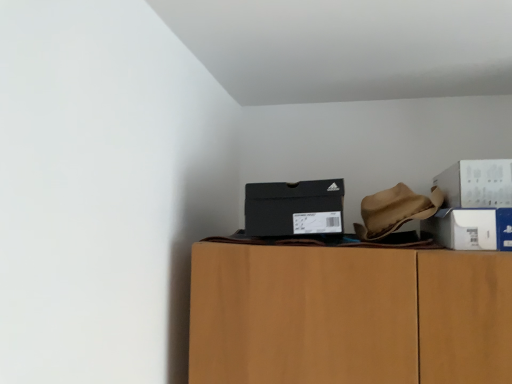
Question: Would you say white cardboard box at right, which ranks as the 2th box in right-to-left order, is outside black matte shoebox at upper center, which is counted as the 1th box, starting from the left?

Choices:
 (A) yes
 (B) no

Answer: (A)

Question: From a real-world perspective, is white cardboard box at right, which ranks as the 2th box in right-to-left order, on top of black matte shoebox at upper center, the 3th box from the right?

Choices:
 (A) yes
 (B) no

Answer: (B)

Question: Does white cardboard box at right, which is the second box from left to right, have a smaller size compared to black matte shoebox at upper center, which is counted as the 1th box, starting from the left?

Choices:
 (A) yes
 (B) no

Answer: (A)

Question: Is white cardboard box at right, which is the second box from left to right, positioned in front of black matte shoebox at upper center, which is counted as the 1th box, starting from the left?

Choices:
 (A) yes
 (B) no

Answer: (A)

Question: Is white cardboard box at right, which is the second box from left to right, aimed at black matte shoebox at upper center, which is counted as the 1th box, starting from the left?

Choices:
 (A) no
 (B) yes

Answer: (A)

Question: Which is correct: white cardboard box at right, which ranks as the 2th box in right-to-left order, is inside black matte shoebox at upper center, the 3th box from the right, or outside of it?

Choices:
 (A) outside
 (B) inside

Answer: (A)

Question: From a real-world perspective, is white cardboard box at right, which ranks as the 2th box in right-to-left order, above or below black matte shoebox at upper center, the 3th box from the right?

Choices:
 (A) below
 (B) above

Answer: (A)

Question: Is point (457, 226) closer or farther from the camera than point (258, 215)?

Choices:
 (A) farther
 (B) closer

Answer: (B)

Question: Is white cardboard box at right, which ranks as the 2th box in right-to-left order, bigger or smaller than black matte shoebox at upper center, the 3th box from the right?

Choices:
 (A) big
 (B) small

Answer: (B)

Question: Considering the positions of white cardboard box at upper right, the third box in the left-to-right sequence, and black matte shoebox at upper center, which is counted as the 1th box, starting from the left, in the image, is white cardboard box at upper right, the third box in the left-to-right sequence, wider or thinner than black matte shoebox at upper center, which is counted as the 1th box, starting from the left,?

Choices:
 (A) thin
 (B) wide

Answer: (B)

Question: Is white cardboard box at upper right, the third box in the left-to-right sequence, taller or shorter than black matte shoebox at upper center, which is counted as the 1th box, starting from the left?

Choices:
 (A) tall
 (B) short

Answer: (B)

Question: From a real-world perspective, is white cardboard box at upper right, the third box in the left-to-right sequence, physically located above or below black matte shoebox at upper center, the 3th box from the right?

Choices:
 (A) above
 (B) below

Answer: (A)

Question: In the image, is white cardboard box at upper right, which is the first box from right to left, on the left side or the right side of black matte shoebox at upper center, which is counted as the 1th box, starting from the left?

Choices:
 (A) right
 (B) left

Answer: (A)

Question: Relative to white cardboard box at right, which ranks as the 2th box in right-to-left order, is white cardboard box at upper right, which is the first box from right to left, in front or behind?

Choices:
 (A) front
 (B) behind

Answer: (A)

Question: From the image's perspective, is white cardboard box at upper right, which is the first box from right to left, above or below white cardboard box at right, which is the second box from left to right?

Choices:
 (A) below
 (B) above

Answer: (B)